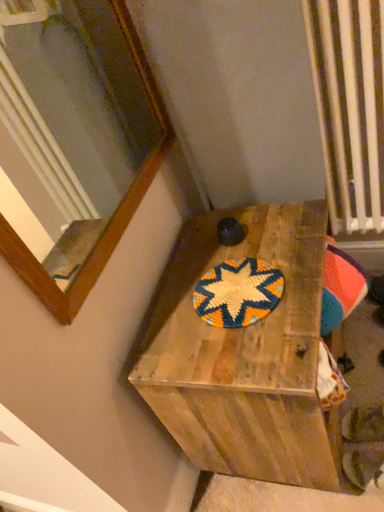
Identify the location of free spot in front of brightly woven mat at center. The image size is (384, 512). (258, 352).